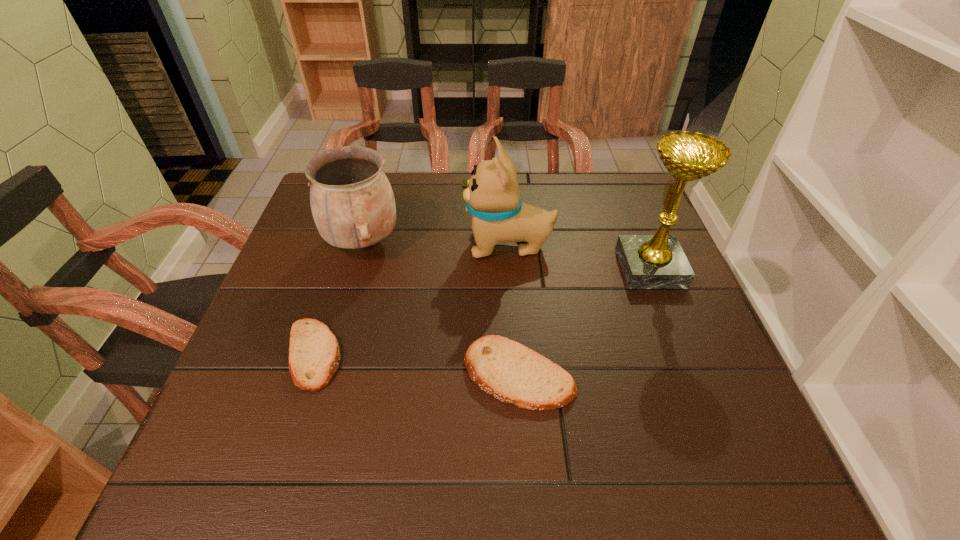
What are the coordinates of `the shorter pita bread` in the screenshot? It's located at [314, 355].

Identify the location of the left pita bread. (314, 355).

Identify the location of the taller pita bread. Image resolution: width=960 pixels, height=540 pixels. (507, 370).

Find the location of a particular element. The height and width of the screenshot is (540, 960). the fourth tallest object is located at coordinates (507, 370).

The image size is (960, 540). I want to click on urn, so click(352, 202).

Locate an element on the screen. This screenshot has width=960, height=540. the rightmost object is located at coordinates (658, 261).

Find the location of a particular element. Image resolution: width=960 pixels, height=540 pixels. puppy is located at coordinates (492, 195).

I want to click on vacant space located 0.330m on the right of the shortest object, so click(508, 355).

You are a GUI agent. You are given a task and a screenshot of the screen. Output one action in this format:
    pyautogui.click(x=<x>, y=<y>)
    Task: Click on the free space located on the left of the right pita bread
    This screenshot has height=540, width=960.
    Given the screenshot: What is the action you would take?
    pyautogui.click(x=421, y=374)

Where is `vacant area situated on the right of the urn`? The image size is (960, 540). vacant area situated on the right of the urn is located at coordinates pyautogui.click(x=526, y=242).